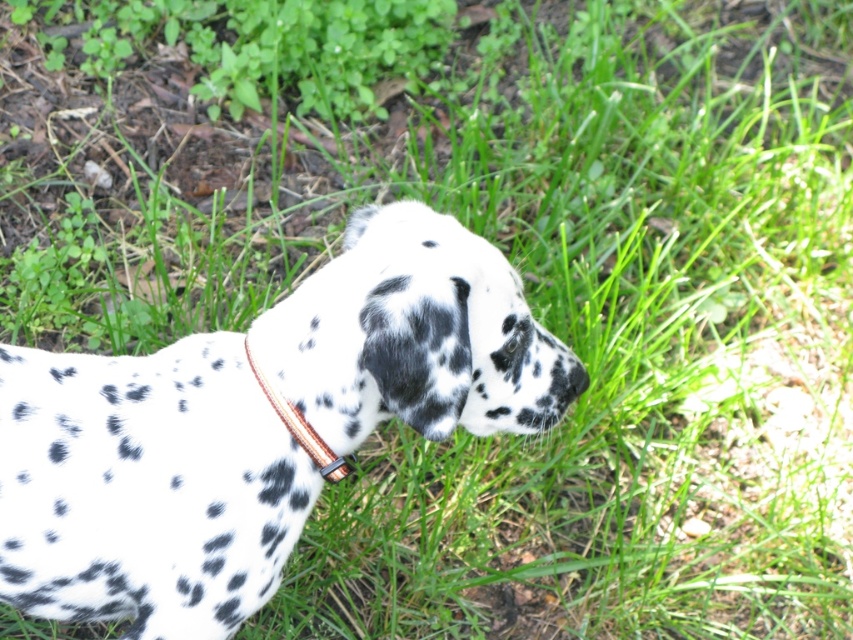
You are a photographer trying to capture the Dalmatian dog in the scene. The spotted fur at center and brown leather collar at center are both in the frame. If you want to focus on the collar, which object should you adjust your camera to be closer to?

The spotted fur at center is taller than the brown leather collar at center, so to focus on the collar, you should adjust your camera to be closer to the brown leather collar at center.

You are standing at the point marked as point (57, 497) and want to take a photo of the Dalmatian dog with your camera. The camera is 1.09 meters away from you. Can you estimate whether the Dalmatian dog will be in the frame of your photo?

The distance between you at point (57, 497) and the camera is 1.09 meters. Since the camera is positioned 1.09 meters away from you, the Dalmatian dog should be within the frame as long as there are no obstructions blocking the view between you and the camera.

You are a dog trainer assessing the Dalmatian in the image. You need to determine if the spotted fur at center can be fully covered by a dog sweater that is designed to fit over the brown leather collar at center. Based on the width comparison between the two, will the sweater fit properly?

The spotted fur at center is wider than the brown leather collar at center. Since the sweater is designed to fit over the collar, the width of the collar may not be sufficient to ensure a proper fit over the wider area of the spotted fur at center. The sweater might be too tight or not fully cover the dog.